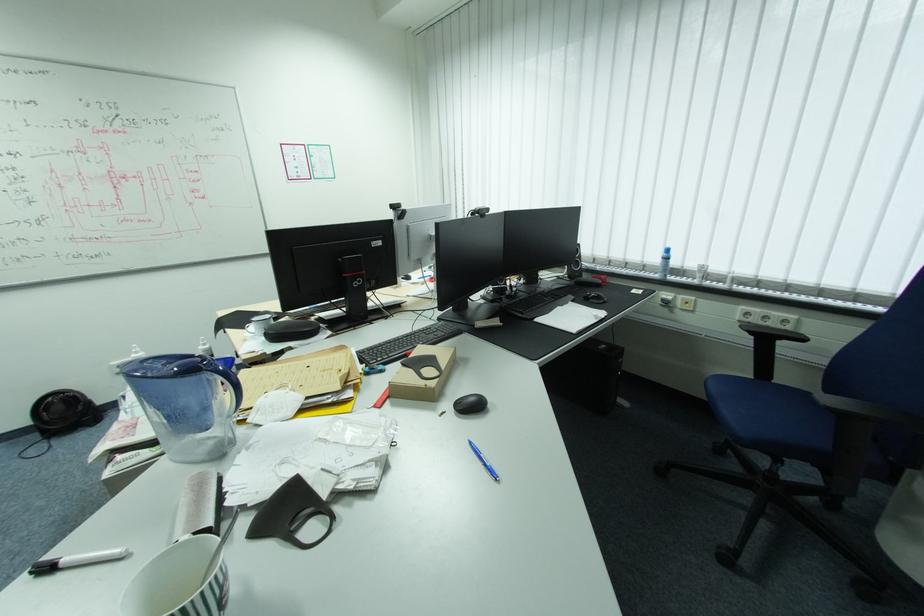
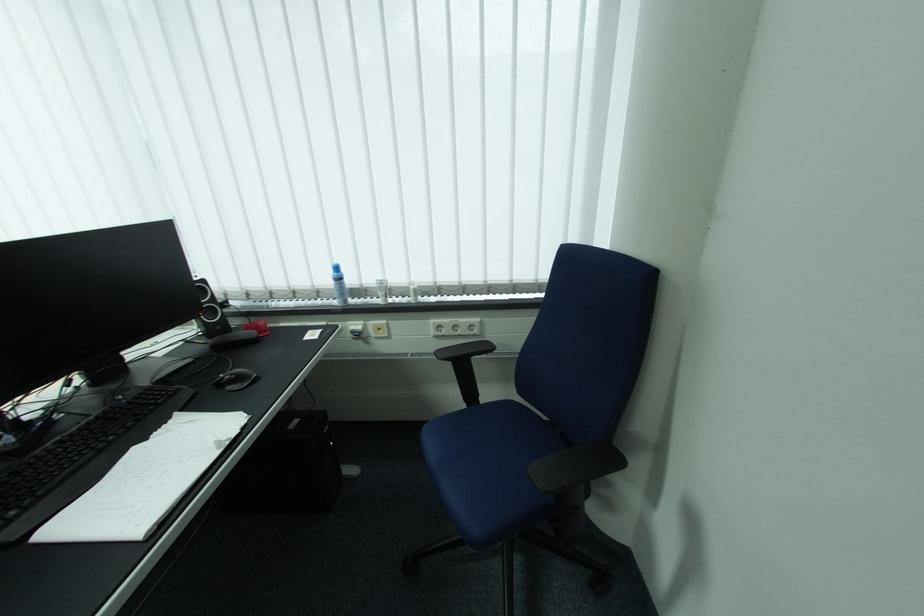
Locate, in the second image, the point that corresponds to (x=758, y=333) in the first image.

(455, 360)